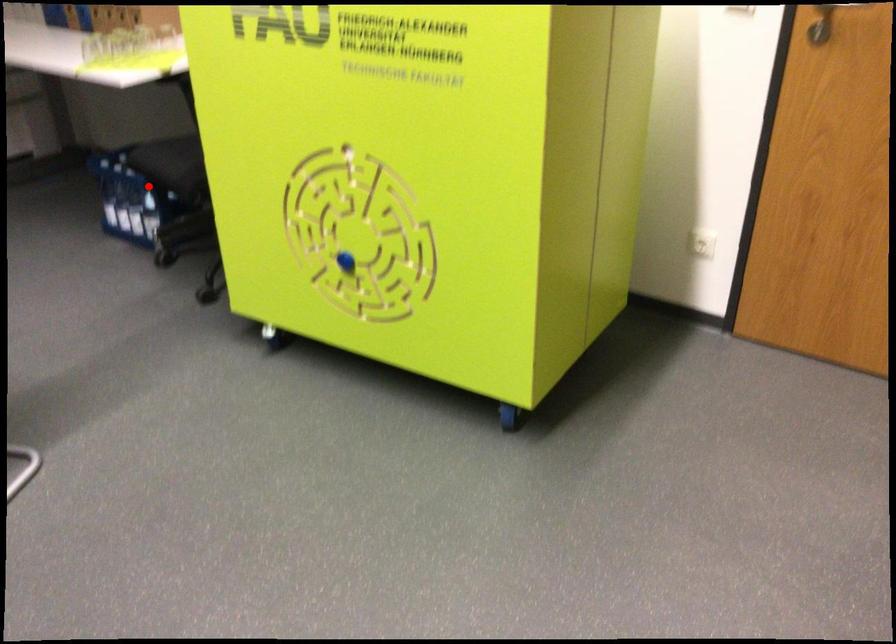
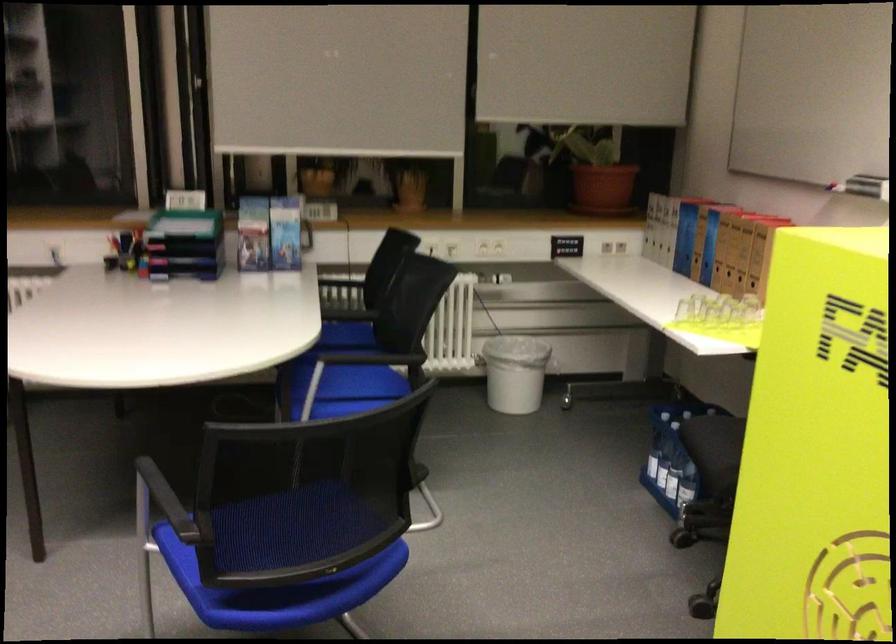
Question: I am providing you with two images of the same scene from different viewpoints. A red point is marked on the first image. Is the red point's position out of view in image 2?

Choices:
 (A) Yes
 (B) No

Answer: (A)